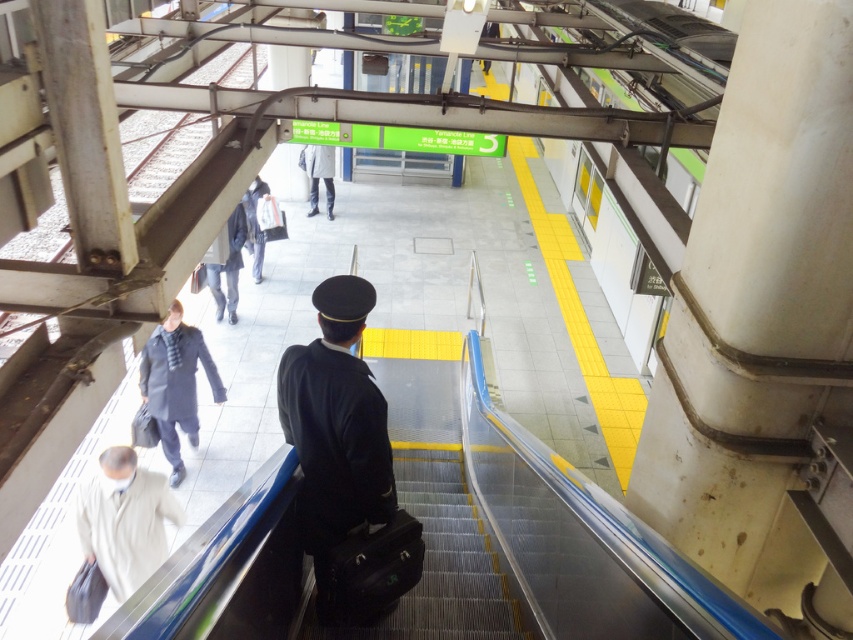
You are standing at point (230, 225) and want to walk to the blue escalator moving upwards. Is point (339, 301) located between you and the escalator?

Yes, point (339, 301) is located between you and the blue escalator moving upwards because it is in front of point (230, 225), which is your current position.